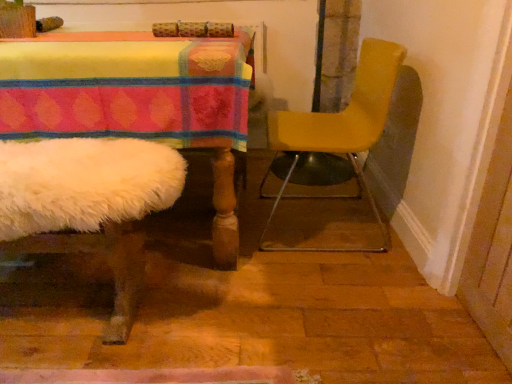
Find the location of `free spot to the left of yellow leather chair at right`. free spot to the left of yellow leather chair at right is located at coordinates (208, 236).